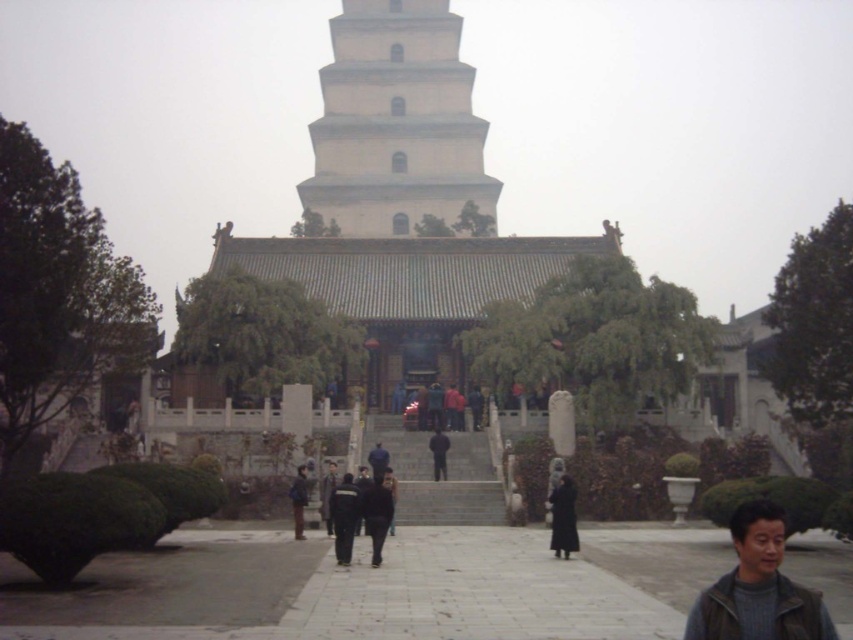
Question: Is white smooth tower at center to the left of dark gray fabric jacket at center from the viewer's perspective?

Choices:
 (A) yes
 (B) no

Answer: (A)

Question: Can you confirm if white smooth tower at center is positioned to the right of dark gray jacket at lower right?

Choices:
 (A) yes
 (B) no

Answer: (B)

Question: Which object is positioned closest to the black matte coat at center?

Choices:
 (A) black fabric coat at center
 (B) white smooth tower at center
 (C) dark gray jacket at lower right
 (D) black matte jacket at center

Answer: (C)

Question: Which object appears farthest from the camera in this image?

Choices:
 (A) black matte coat at center
 (B) dark gray jacket at lower right
 (C) black matte jacket at center

Answer: (C)

Question: Among these objects, which one is nearest to the camera?

Choices:
 (A) white smooth tower at center
 (B) dark gray jacket at lower right
 (C) black fabric coat at center
 (D) black matte jacket at center

Answer: (B)

Question: Is black matte coat at center to the right of black matte jacket at center from the viewer's perspective?

Choices:
 (A) no
 (B) yes

Answer: (B)